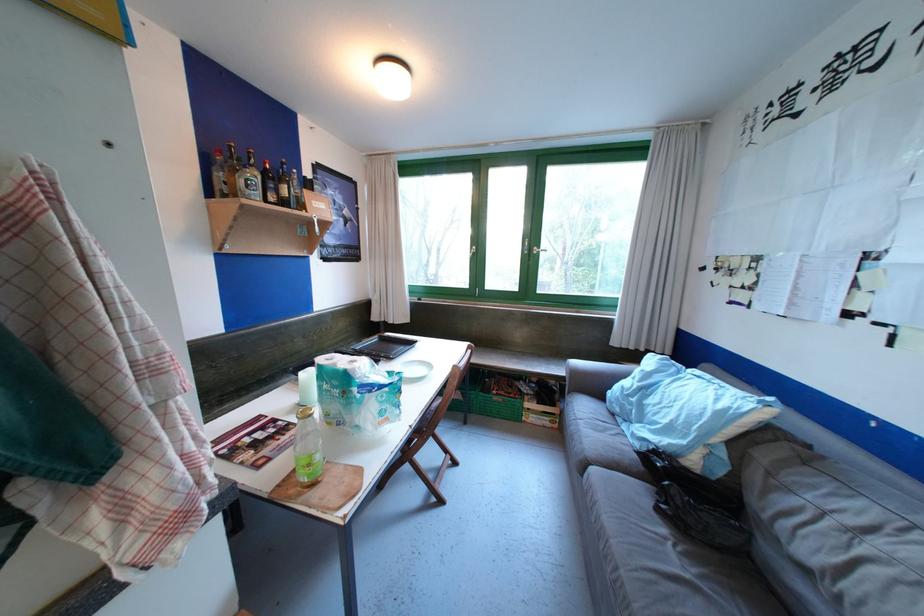
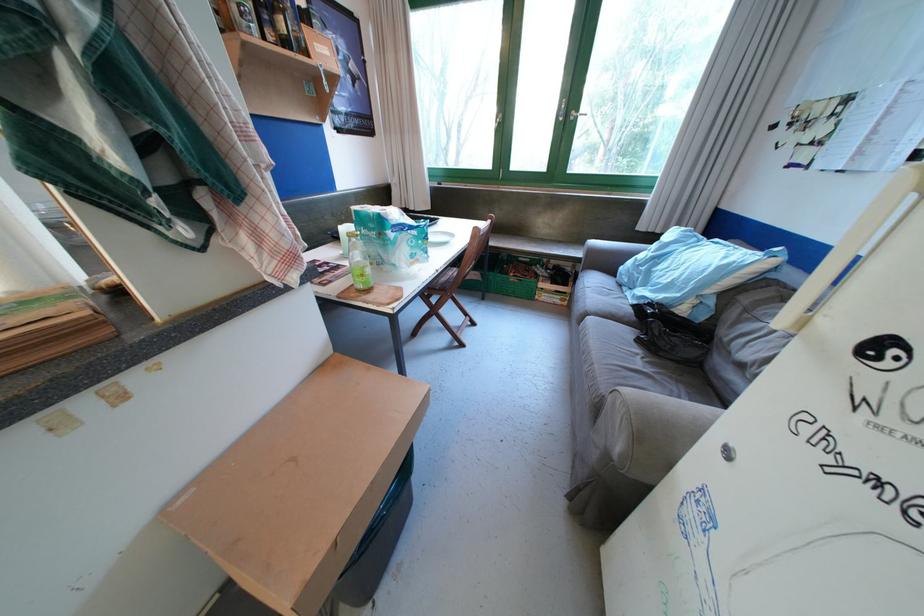
Question: The images are taken continuously from a first-person perspective. In which direction are you moving?

Choices:
 (A) Left
 (B) Right
 (C) Forward
 (D) Backward

Answer: (D)